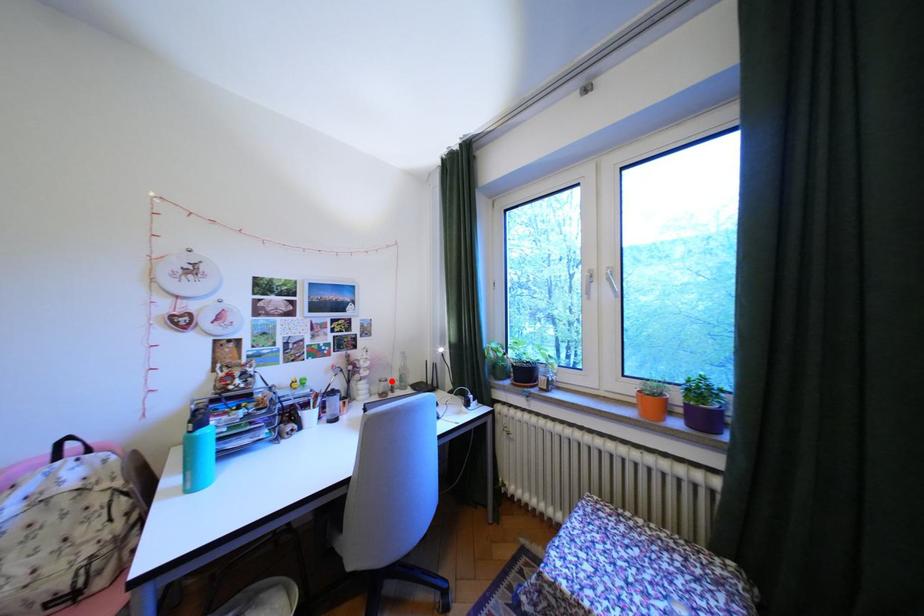
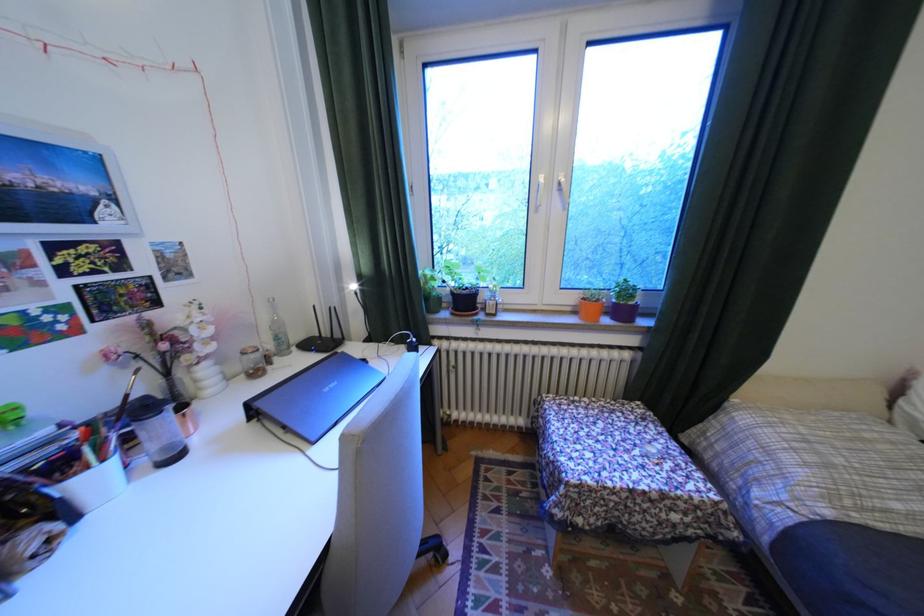
Question: I am providing you with two images of the same scene from different viewpoints. Image1 has a red point marked. In image2, the corresponding 3D location appears at what relative position? Reply with the corresponding letter.

Choices:
 (A) Closer
 (B) Farther

Answer: (A)